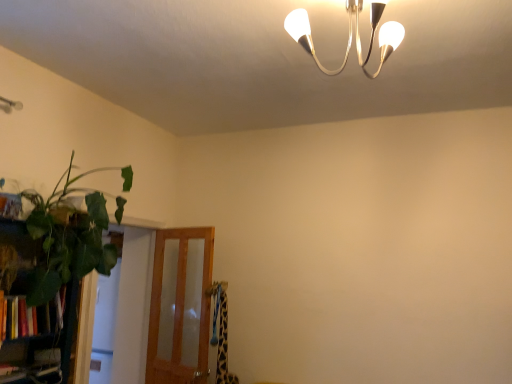
Question: In terms of size, does hardcover books at left appear bigger or smaller than green leafy plant at left?

Choices:
 (A) big
 (B) small

Answer: (B)

Question: Is hardcover books at left wider or thinner than green leafy plant at left?

Choices:
 (A) thin
 (B) wide

Answer: (A)

Question: Estimate the real-world distances between objects in this image. Which object is closer to the green leafy plant at left?

Choices:
 (A) hardcover books at left
 (B) translucent wood screen door at lower left
 (C) green leafy plant at left

Answer: (A)

Question: Which object is the farthest from the translucent wood screen door at lower left?

Choices:
 (A) green leafy plant at left
 (B) hardcover books at left
 (C) green leafy plant at left

Answer: (B)